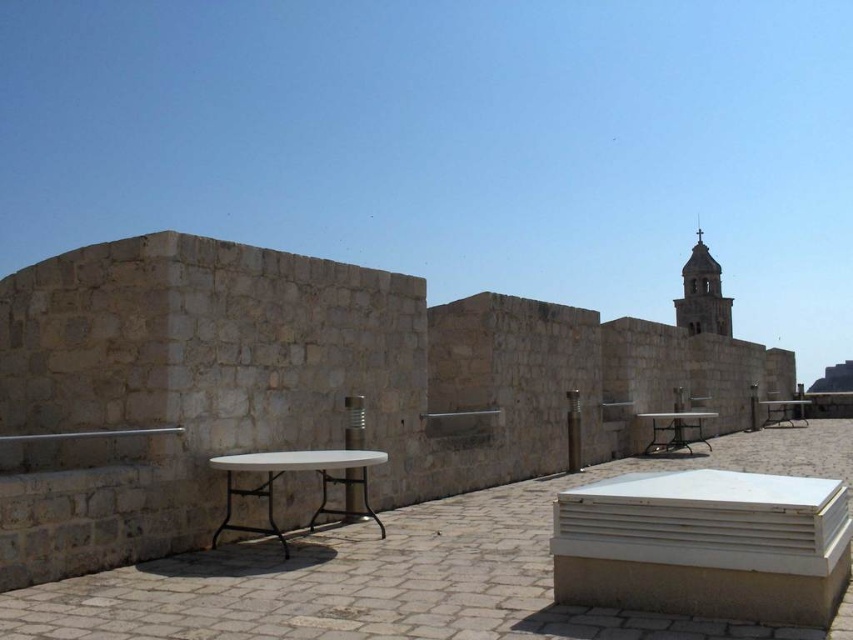
You are standing on the paved area and want to move from the white plastic table at left to the metallic silver table at center. Which direction should you move to reach it?

You should move to the right to reach the metallic silver table at center because the white plastic table at left is located to the left of it.

You are planning to place a large potted plant between the metallic silver table at center and the white metal table at center. Which table should you move to make more space for the plant?

The white metal table at center should be moved because it occupies more space than the metallic silver table at center, allowing for more room when relocated.